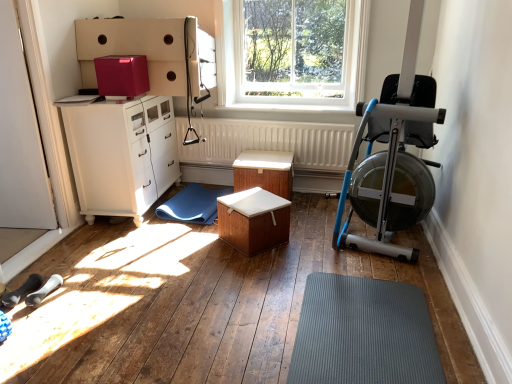
Identify the location of vacant space underneath gray rubber mat at lower center, acting as the first doormat starting from the bottom (from a real-world perspective). This screenshot has height=384, width=512. (384, 331).